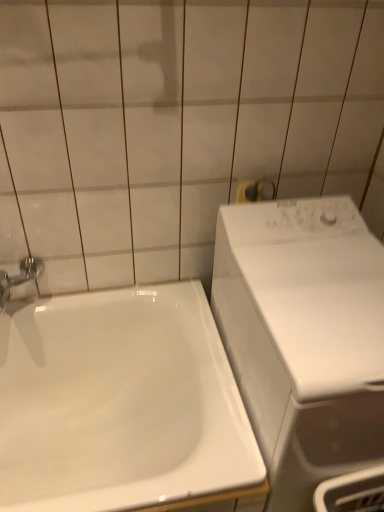
Question: Can white glossy sink at lower left be found inside white glossy washing machine at right?

Choices:
 (A) yes
 (B) no

Answer: (B)

Question: From the image's perspective, is white glossy washing machine at right located beneath white glossy sink at lower left?

Choices:
 (A) no
 (B) yes

Answer: (A)

Question: Considering the relative sizes of white glossy washing machine at right and white glossy sink at lower left in the image provided, is white glossy washing machine at right taller than white glossy sink at lower left?

Choices:
 (A) no
 (B) yes

Answer: (B)

Question: From a real-world perspective, is white glossy washing machine at right below white glossy sink at lower left?

Choices:
 (A) yes
 (B) no

Answer: (B)

Question: Is white glossy washing machine at right outside of white glossy sink at lower left?

Choices:
 (A) no
 (B) yes

Answer: (B)

Question: Considering the positions of white glossy sink at lower left and white glossy washing machine at right in the image, is white glossy sink at lower left bigger or smaller than white glossy washing machine at right?

Choices:
 (A) big
 (B) small

Answer: (A)

Question: Considering the positions of white glossy sink at lower left and white glossy washing machine at right in the image, is white glossy sink at lower left taller or shorter than white glossy washing machine at right?

Choices:
 (A) tall
 (B) short

Answer: (B)

Question: Considering their positions, is white glossy sink at lower left located in front of or behind white glossy washing machine at right?

Choices:
 (A) front
 (B) behind

Answer: (B)

Question: From a real-world perspective, is white glossy sink at lower left above or below white glossy washing machine at right?

Choices:
 (A) above
 (B) below

Answer: (B)

Question: From a real-world perspective, is white glossy washing machine at right above or below white glossy sink at lower left?

Choices:
 (A) below
 (B) above

Answer: (B)

Question: Considering the positions of white glossy washing machine at right and white glossy sink at lower left in the image, is white glossy washing machine at right wider or thinner than white glossy sink at lower left?

Choices:
 (A) thin
 (B) wide

Answer: (A)

Question: Is white glossy washing machine at right bigger or smaller than white glossy sink at lower left?

Choices:
 (A) big
 (B) small

Answer: (B)

Question: In the image, is white glossy washing machine at right positioned in front of or behind white glossy sink at lower left?

Choices:
 (A) behind
 (B) front

Answer: (B)

Question: Considering their positions, is white glossy sink at lower left located in front of or behind chrome metallic faucet at left?

Choices:
 (A) front
 (B) behind

Answer: (A)

Question: Considering the positions of point (13, 484) and point (41, 269), is point (13, 484) closer or farther from the camera than point (41, 269)?

Choices:
 (A) farther
 (B) closer

Answer: (B)